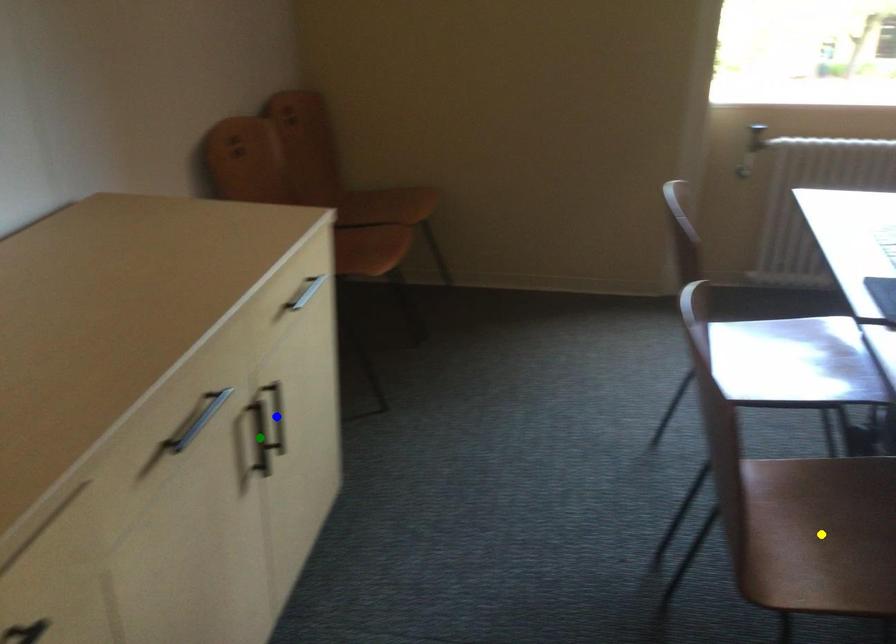
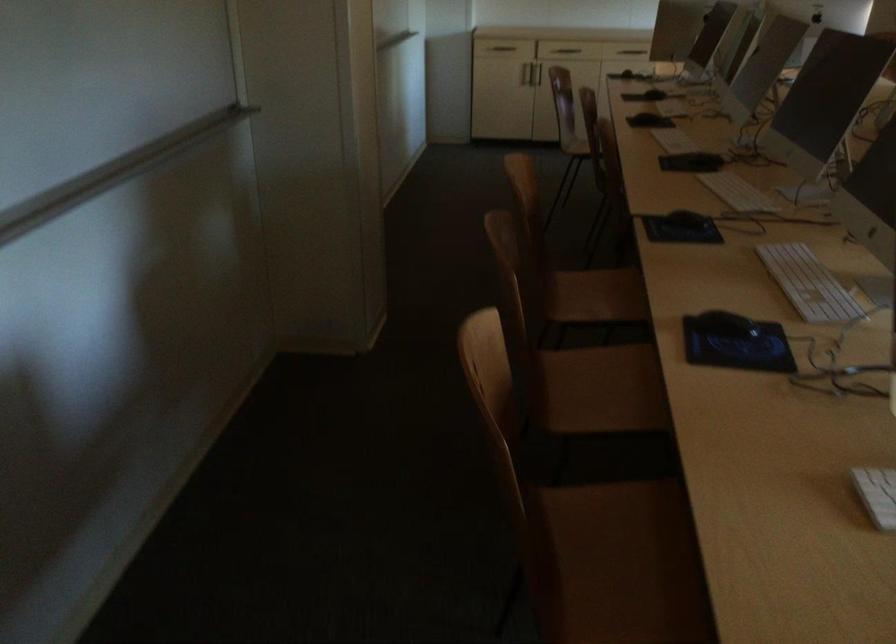
I am providing you with two images of the same scene from different viewpoints. Three points are marked in image1. Which point corresponds to a part or object that is occluded in image2?In image1, three points are marked. Which of them correspond to a part or object that is occluded in image2?Among the three points shown in image1, which one corresponds to a part or object that is no longer visible due to occlusion in image2?

yellow point, blue point, green point